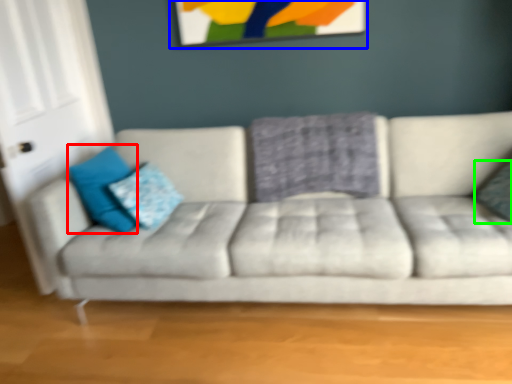
Question: Which object is the closest to the pillow (highlighted by a red box)? Choose among these: picture frame (highlighted by a blue box) or pillow (highlighted by a green box).

Choices:
 (A) picture frame
 (B) pillow

Answer: (A)